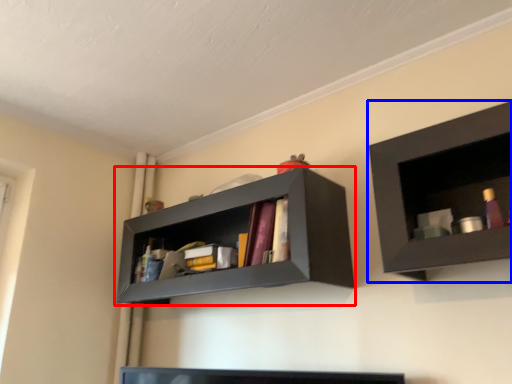
Question: Which point is further to the camera, shelf (highlighted by a red box) or shelf (highlighted by a blue box)?

Choices:
 (A) shelf
 (B) shelf

Answer: (A)